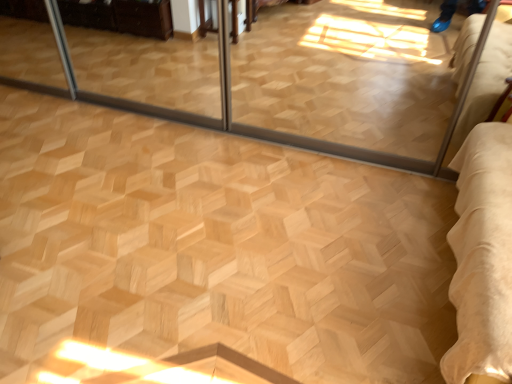
What is the approximate height of natural wood parquet floor at center?

The height of natural wood parquet floor at center is 5.03 centimeters.

Find the location of a particular element. The image size is (512, 384). natural wood parquet floor at center is located at coordinates (217, 246).

What do you see at coordinates (217, 246) in the screenshot? This screenshot has height=384, width=512. I see `natural wood parquet floor at center` at bounding box center [217, 246].

Locate an element on the screen. Image resolution: width=512 pixels, height=384 pixels. natural wood parquet floor at center is located at coordinates (217, 246).